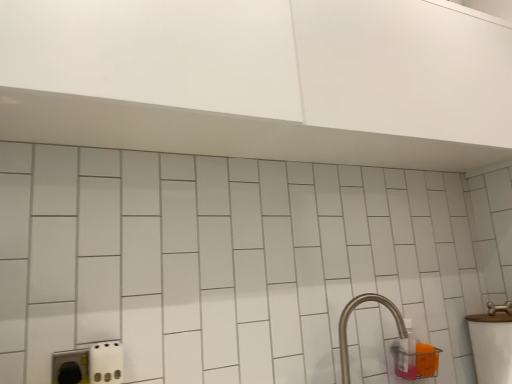
Question: From the image's perspective, is white glossy sink at right below satin nickel faucet at lower right?

Choices:
 (A) yes
 (B) no

Answer: (A)

Question: Is white glossy sink at right wider than satin nickel faucet at lower right?

Choices:
 (A) yes
 (B) no

Answer: (A)

Question: Is white glossy sink at right positioned before satin nickel faucet at lower right?

Choices:
 (A) no
 (B) yes

Answer: (A)

Question: Is the depth of white glossy sink at right greater than that of satin nickel faucet at lower right?

Choices:
 (A) yes
 (B) no

Answer: (A)

Question: Can we say white glossy sink at right lies outside satin nickel faucet at lower right?

Choices:
 (A) no
 (B) yes

Answer: (B)

Question: From a real-world perspective, is white glossy sink at right located higher than satin nickel faucet at lower right?

Choices:
 (A) no
 (B) yes

Answer: (A)

Question: Can you confirm if satin nickel faucet at lower right is positioned to the left of translucent plastic bottle at lower right?

Choices:
 (A) no
 (B) yes

Answer: (B)

Question: Is satin nickel faucet at lower right shorter than translucent plastic bottle at lower right?

Choices:
 (A) yes
 (B) no

Answer: (B)

Question: Is satin nickel faucet at lower right oriented away from translucent plastic bottle at lower right?

Choices:
 (A) no
 (B) yes

Answer: (A)

Question: Does satin nickel faucet at lower right contain translucent plastic bottle at lower right?

Choices:
 (A) no
 (B) yes

Answer: (A)

Question: Considering the relative sizes of satin nickel faucet at lower right and translucent plastic bottle at lower right in the image provided, is satin nickel faucet at lower right wider than translucent plastic bottle at lower right?

Choices:
 (A) yes
 (B) no

Answer: (A)

Question: Can you see satin nickel faucet at lower right touching translucent plastic bottle at lower right?

Choices:
 (A) no
 (B) yes

Answer: (A)

Question: Is white glossy sink at right directly adjacent to translucent plastic bottle at lower right?

Choices:
 (A) no
 (B) yes

Answer: (A)